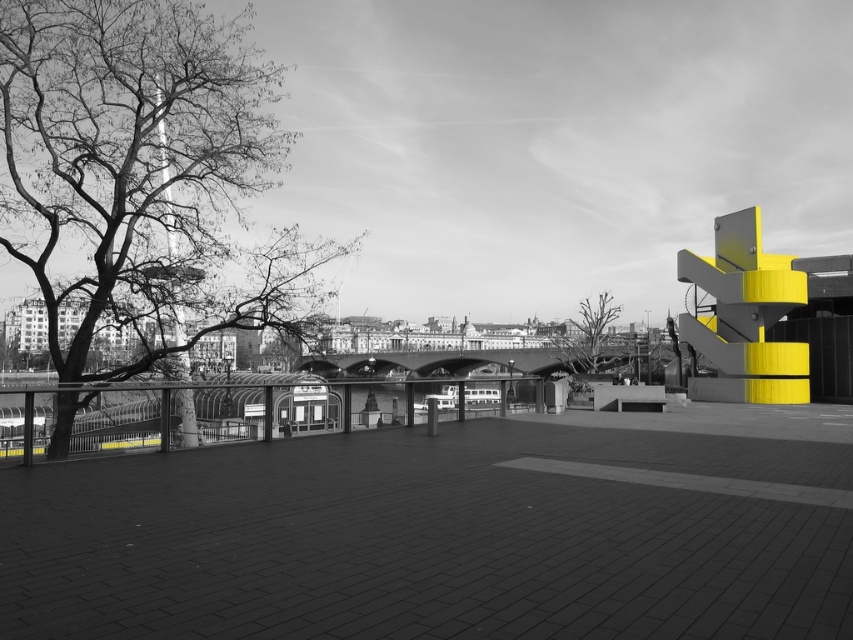
In the scene shown: Can you confirm if bare branches at left is bigger than bare branches at center?

No.

Is bare branches at left shorter than bare branches at center?

No.

Describe the element at coordinates (138, 168) in the screenshot. This screenshot has height=640, width=853. I see `bare branches at left` at that location.

This screenshot has height=640, width=853. I want to click on bare branches at left, so click(x=138, y=168).